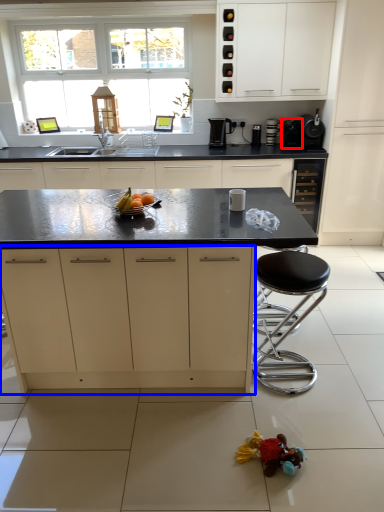
Question: Which point is closer to the camera, appliance (highlighted by a red box) or cabinetry (highlighted by a blue box)?

Choices:
 (A) appliance
 (B) cabinetry

Answer: (B)